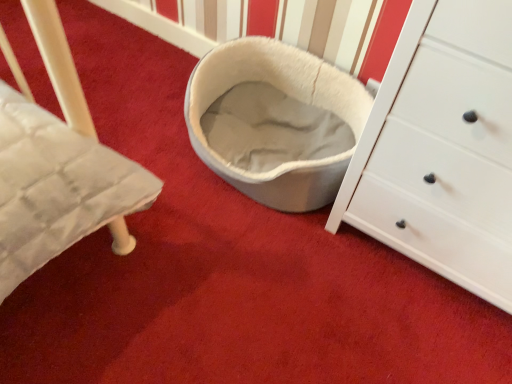
In order to click on white soft pet bed at center in this screenshot , I will do `click(289, 95)`.

Describe the element at coordinates (289, 95) in the screenshot. I see `white soft pet bed at center` at that location.

Measure the distance between white soft pet bed at center and camera.

white soft pet bed at center is 4.63 feet from camera.

Identify the location of white soft pet bed at center. (289, 95).